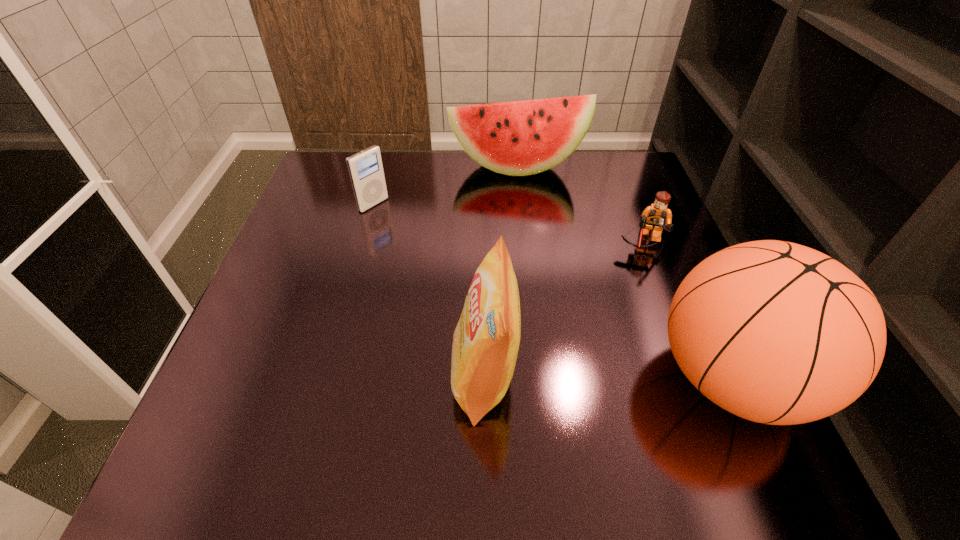
What are the coordinates of `vacant space on the desktop that is between the crisp (potato chip) and the basketball and is positioned holding a crossbow in the hands of the shortest object` in the screenshot? It's located at (641, 377).

Image resolution: width=960 pixels, height=540 pixels. Find the location of `vacant space on the desktop that is between the crisp (potato chip) and the basketball and is positioned on the outer rind of the farthest object`. vacant space on the desktop that is between the crisp (potato chip) and the basketball and is positioned on the outer rind of the farthest object is located at coordinates (571, 377).

The height and width of the screenshot is (540, 960). I want to click on free space on the desktop that is between the crisp (potato chip) and the basketball and is positioned on the front-facing side of the iPod, so click(644, 377).